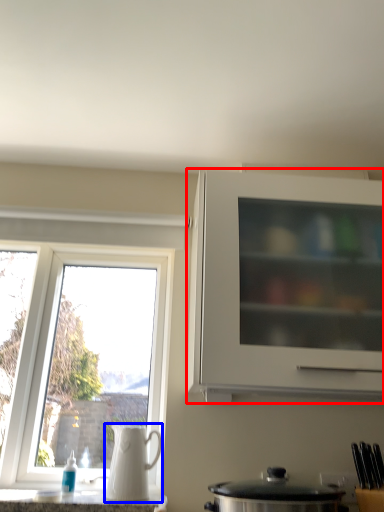
Question: Among these objects, which one is nearest to the camera, cabinetry (highlighted by a red box) or jug (highlighted by a blue box)?

Choices:
 (A) cabinetry
 (B) jug

Answer: (A)